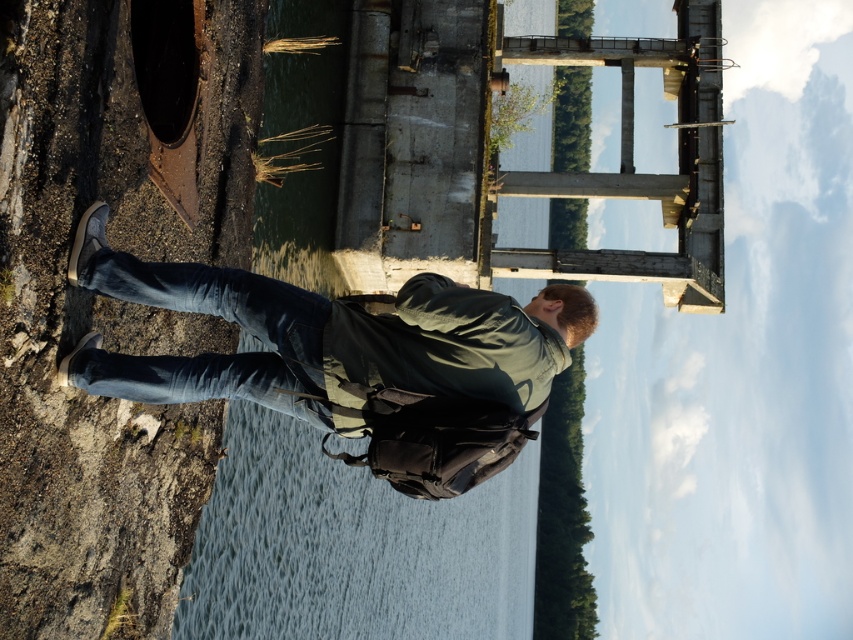
Question: Which point is farther from the camera taking this photo?

Choices:
 (A) (27, 579)
 (B) (131, 378)

Answer: (B)

Question: Can you confirm if rusty metal cliff at lower left is wider than denim jacket at center?

Choices:
 (A) no
 (B) yes

Answer: (A)

Question: From the image, what is the correct spatial relationship of rusty metal cliff at lower left in relation to denim jacket at center?

Choices:
 (A) right
 (B) left

Answer: (B)

Question: Which point is closer to the camera?

Choices:
 (A) (189, 372)
 (B) (190, 433)

Answer: (A)

Question: Does rusty metal cliff at lower left appear under denim jacket at center?

Choices:
 (A) yes
 (B) no

Answer: (A)